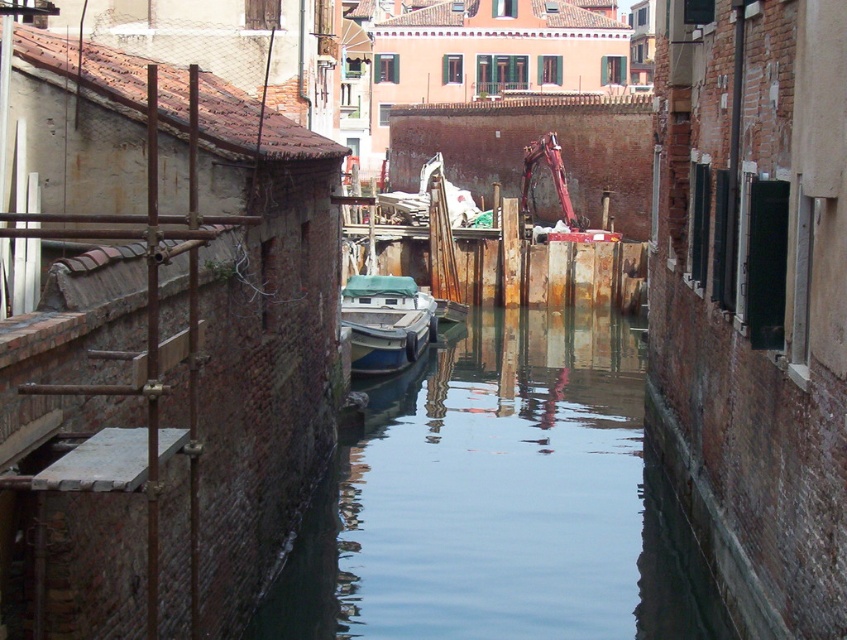
You are standing on a gondola in the middle of the canal and want to look at the brick wall at center and the clear water at center. Which object is closer to you?

The brick wall at center is in front of clear water at center, so the brick wall at center is closer to you.